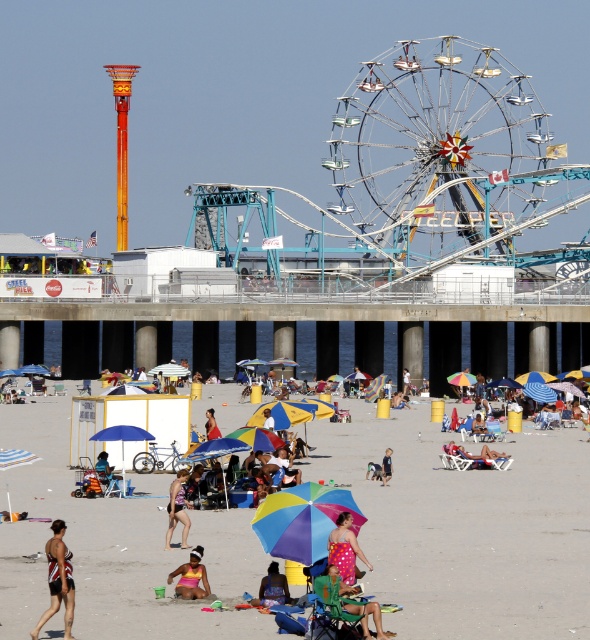
You are a photographer standing on the beach and want to take a photo of the multicolored umbrellas at center and the multicolored swimsuit at center. Which object should you focus on first if you want to capture both in the same frame without moving the camera?

The multicolored umbrellas at center is much taller than the multicolored swimsuit at center, so you should focus on the multicolored umbrellas at center first to ensure they are in frame, then adjust the focus to include the multicolored swimsuit at center.